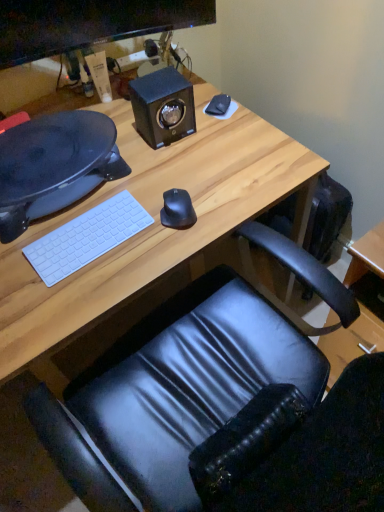
You are a GUI agent. You are given a task and a screenshot of the screen. Output one action in this format:
    pyautogui.click(x=<x>, y=<y>)
    Task: Click on the vacant space that is in between black matte mouse at center and black textured speaker at upper center
    The height and width of the screenshot is (512, 384).
    Given the screenshot: What is the action you would take?
    pyautogui.click(x=173, y=172)